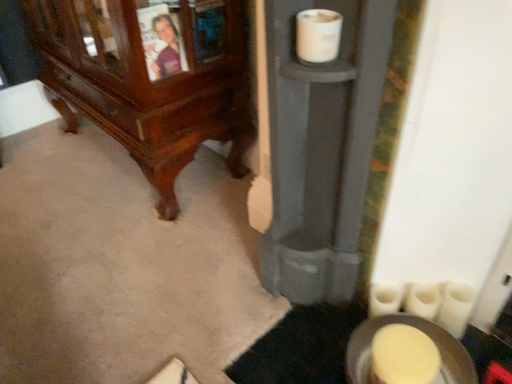
Question: Is white matte toilet paper at lower right, which is counted as the 2th toilet paper, starting from the top, situated inside white matte toilet paper at upper center, acting as the 3th toilet paper starting from the back, or outside?

Choices:
 (A) inside
 (B) outside

Answer: (B)

Question: From a real-world perspective, is white matte toilet paper at lower right, acting as the 3th toilet paper starting from the front, physically located above or below white matte toilet paper at upper center, acting as the 3th toilet paper starting from the back?

Choices:
 (A) above
 (B) below

Answer: (B)

Question: Which of these objects is positioned farthest from the polished wood cabinet at lower left?

Choices:
 (A) white matte toilet paper at lower right, the second toilet paper viewed from the back
 (B) white matte toilet paper at lower right, the second toilet paper from the right
 (C) white matte toilet paper at upper center, acting as the 1th toilet paper starting from the front

Answer: (A)

Question: Considering the real-world distances, which object is closest to the white matte toilet paper at lower right, the second toilet paper when ordered from front to back?

Choices:
 (A) white matte toilet paper at upper center, the 1th toilet paper viewed from the left
 (B) polished wood cabinet at lower left
 (C) white matte toilet paper at lower right, the 2th toilet paper in the left-to-right sequence

Answer: (C)